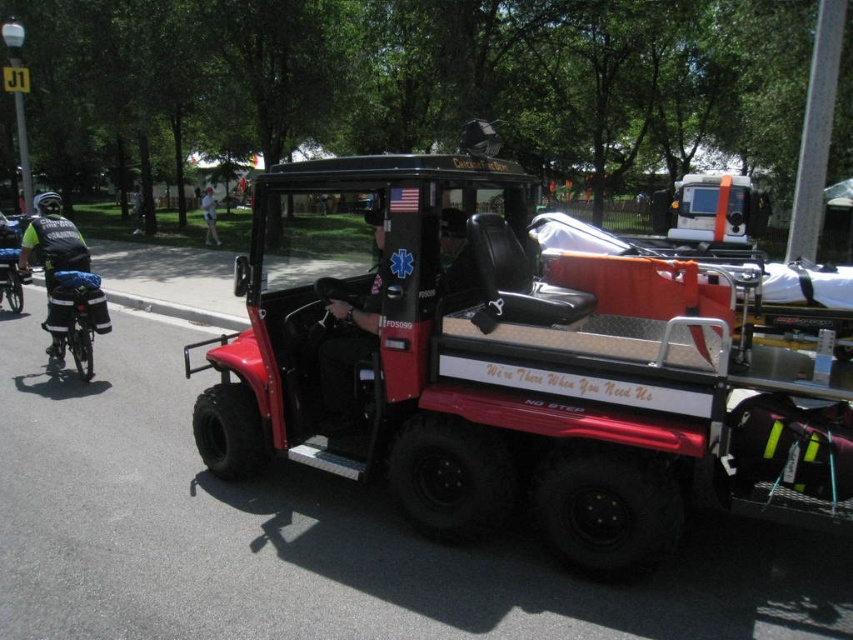
Image resolution: width=853 pixels, height=640 pixels. What do you see at coordinates (74, 316) in the screenshot? I see `blue fabric bag at left` at bounding box center [74, 316].

Is blue fabric bag at left positioned before light blue fabric shirt at center?

Yes, it is.

Image resolution: width=853 pixels, height=640 pixels. In order to click on blue fabric bag at left in this screenshot , I will do `click(74, 316)`.

Between red matte utility vehicle at center and blue fabric bag at left, which one appears on the left side from the viewer's perspective?

blue fabric bag at left

How distant is red matte utility vehicle at center from blue fabric bag at left?

red matte utility vehicle at center and blue fabric bag at left are 3.43 meters apart from each other.

Find the location of a particular element. red matte utility vehicle at center is located at coordinates (524, 358).

Locate an element on the screen. This screenshot has height=640, width=853. red matte utility vehicle at center is located at coordinates (524, 358).

Does point (84, 288) lie behind point (50, 344)?

That is False.

Does point (59, 348) come in front of point (22, 248)?

No, (59, 348) is behind (22, 248).

At what (x,y) coordinates should I click in order to perform the action: click on blue fabric bag at left. Please return your answer as a coordinate pair (x, y). The height and width of the screenshot is (640, 853). Looking at the image, I should click on (74, 316).